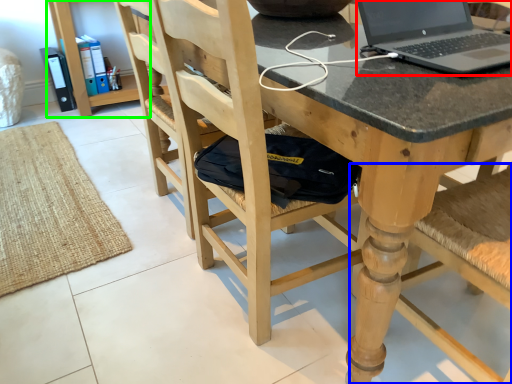
Question: Based on their relative distances, which object is farther from laptop (highlighted by a red box)? Choose from chair (highlighted by a blue box) and bookshelf (highlighted by a green box).

Choices:
 (A) chair
 (B) bookshelf

Answer: (B)